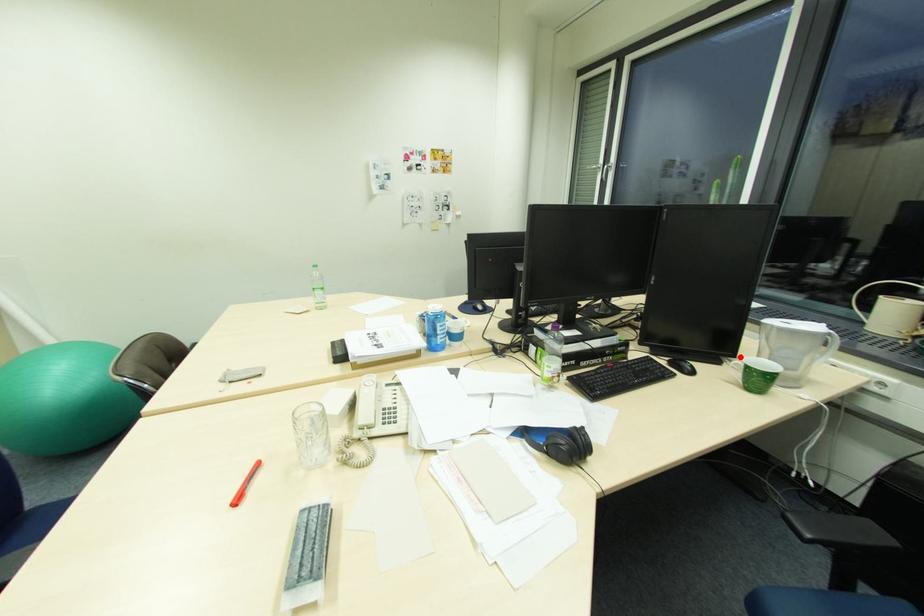
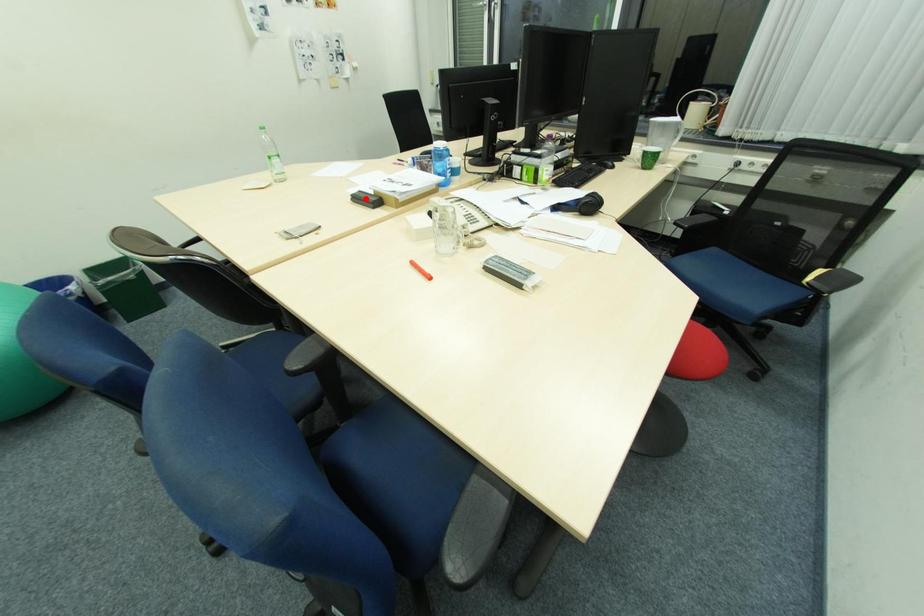
I am providing you with two images of the same scene from different viewpoints. A red point is marked on the first image and another point is marked on the second image. Does the point marked in image1 correspond to the same location as the one in image2?

No